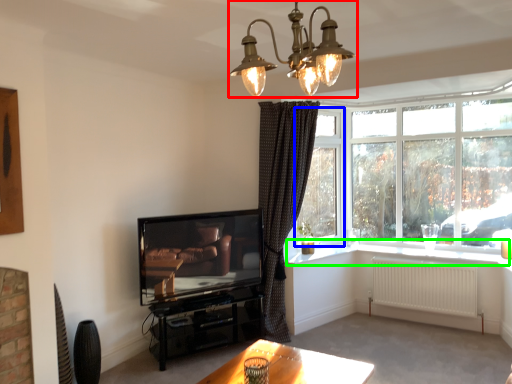
Question: Which object is positioned closest to lamp (highlighted by a red box)? Select from window screen (highlighted by a blue box) and window sill (highlighted by a green box).

Choices:
 (A) window screen
 (B) window sill

Answer: (B)